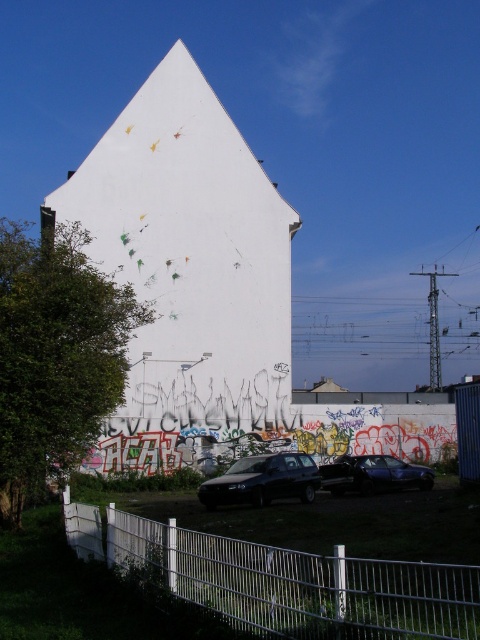
Measure the distance between point (417, 596) and camera.

Answer: A distance of 5.14 meters exists between point (417, 596) and camera.

Based on the photo, is white metal fence at lower center in front of metallic blue sedan at center?

Yes, it is in front of metallic blue sedan at center.

Is point (140, 570) behind point (370, 461)?

No.

Find the location of a particular element. white metal fence at lower center is located at coordinates (282, 580).

Which is more to the left, matte black car at center or metallic blue sedan at center?

matte black car at center is more to the left.

At what (x,y) coordinates should I click in order to perform the action: click on matte black car at center. Please return your answer as a coordinate pair (x, y). The image size is (480, 640). Looking at the image, I should click on (263, 481).

Is point (252, 493) farther from camera compared to point (355, 483)?

No, it is not.

This screenshot has width=480, height=640. What are the coordinates of `matte black car at center` in the screenshot? It's located at (263, 481).

Between white metal fence at lower center and matte black car at center, which one appears on the right side from the viewer's perspective?

From the viewer's perspective, white metal fence at lower center appears more on the right side.

Between point (94, 522) and point (245, 483), which one is positioned in front?

Positioned in front is point (94, 522).

Find the location of a particular element. The width and height of the screenshot is (480, 640). white metal fence at lower center is located at coordinates (x=282, y=580).